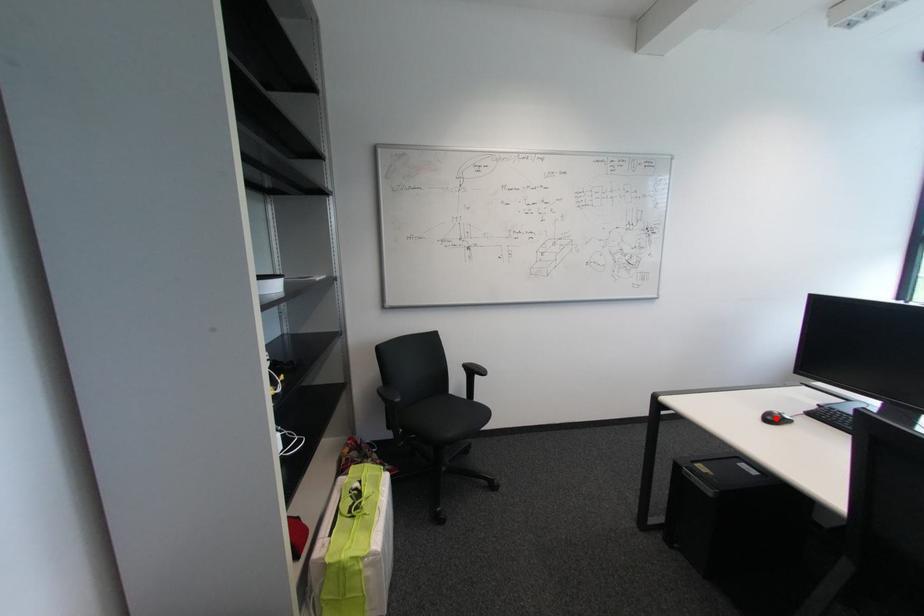
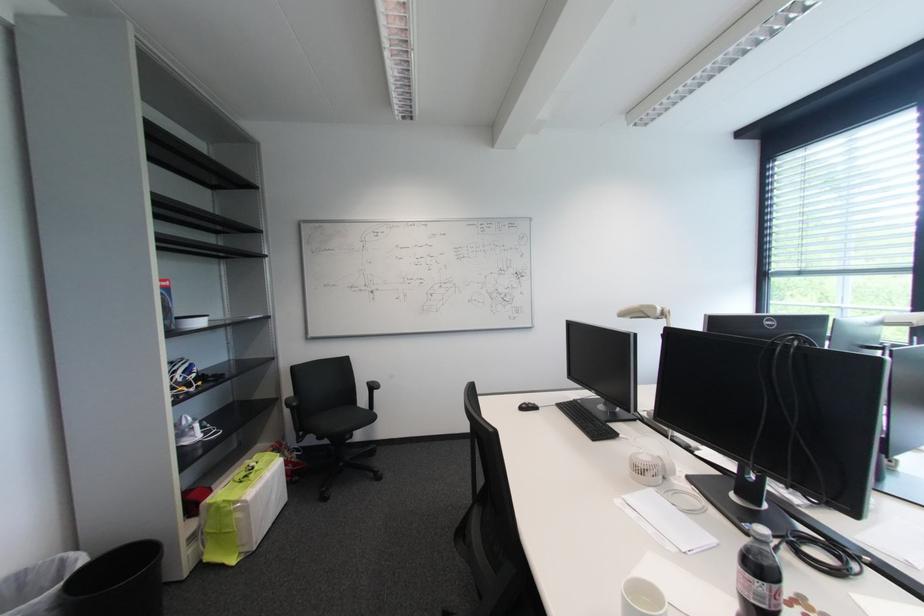
Find the pixel in the second image that matches the highlighted location in the first image.

(530, 408)